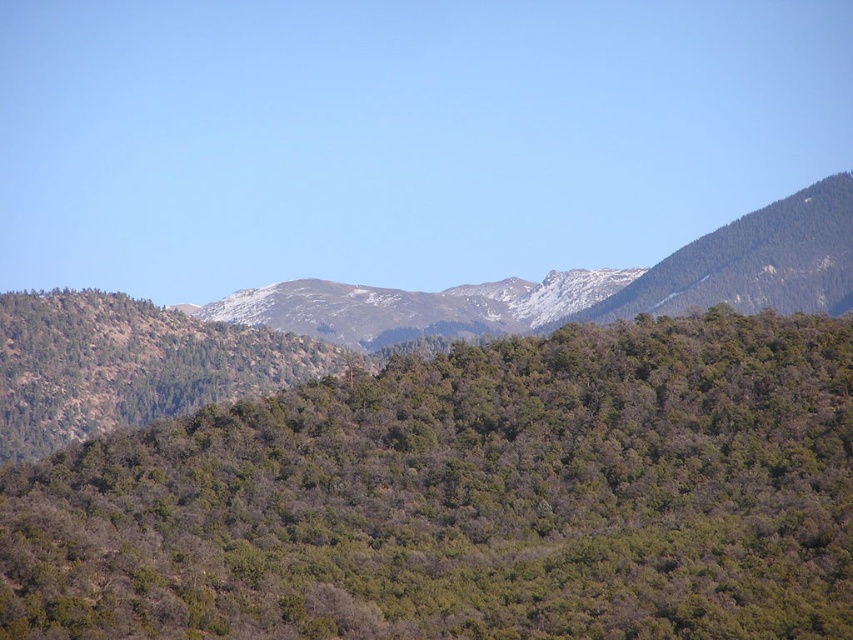
Based on the scene description, which object occupies more horizontal space in the image? The green leafy forest at center or the snowy rocky mountain range at center?

The green leafy forest at center might be wider than snowy rocky mountain range at center according to the description.

You are standing at the viewpoint in the image and want to know how far the point at coordinates point (x=347, y=636) is from you. Can you determine the distance?

The point at coordinates point (x=347, y=636) is 320.87 meters away from you.